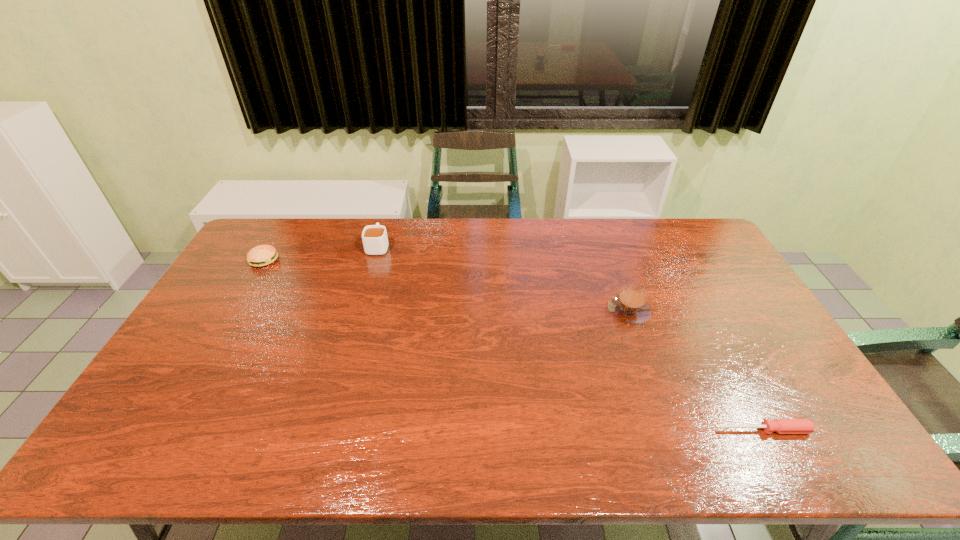
Find the location of a particular element. The height and width of the screenshot is (540, 960). free space between the third tallest object and the cup is located at coordinates (322, 253).

Image resolution: width=960 pixels, height=540 pixels. Find the location of `empty space between the third tallest object and the cup`. empty space between the third tallest object and the cup is located at coordinates (322, 253).

The image size is (960, 540). In order to click on free space between the rightmost object and the second object from left to right in this screenshot , I will do `click(571, 338)`.

Find the location of `vacant point located between the rightmost object and the second object from left to right`. vacant point located between the rightmost object and the second object from left to right is located at coordinates (571, 338).

The width and height of the screenshot is (960, 540). I want to click on vacant area that lies between the cappuccino and the shortest object, so click(x=696, y=370).

The height and width of the screenshot is (540, 960). Find the location of `free space between the nearest object and the cappuccino`. free space between the nearest object and the cappuccino is located at coordinates (696, 370).

Locate which object ranks second in proximity to the second nearest object. Please provide its 2D coordinates. Your answer should be formatted as a tuple, i.e. [(x, y)], where the tuple contains the x and y coordinates of a point satisfying the conditions above.

[(375, 241)]

Choose which object is the second nearest neighbor to the leftmost object. Please provide its 2D coordinates. Your answer should be formatted as a tuple, i.e. [(x, y)], where the tuple contains the x and y coordinates of a point satisfying the conditions above.

[(629, 306)]

The image size is (960, 540). What are the coordinates of `vacant position in the image that satisfies the following two spatial constraints: 1. on the front side of the rightmost object; 2. on the right side of the leftmost object` in the screenshot? It's located at (165, 430).

Locate an element on the screen. vacant position in the image that satisfies the following two spatial constraints: 1. on the front side of the second object from right to left; 2. on the left side of the patty is located at coordinates (235, 310).